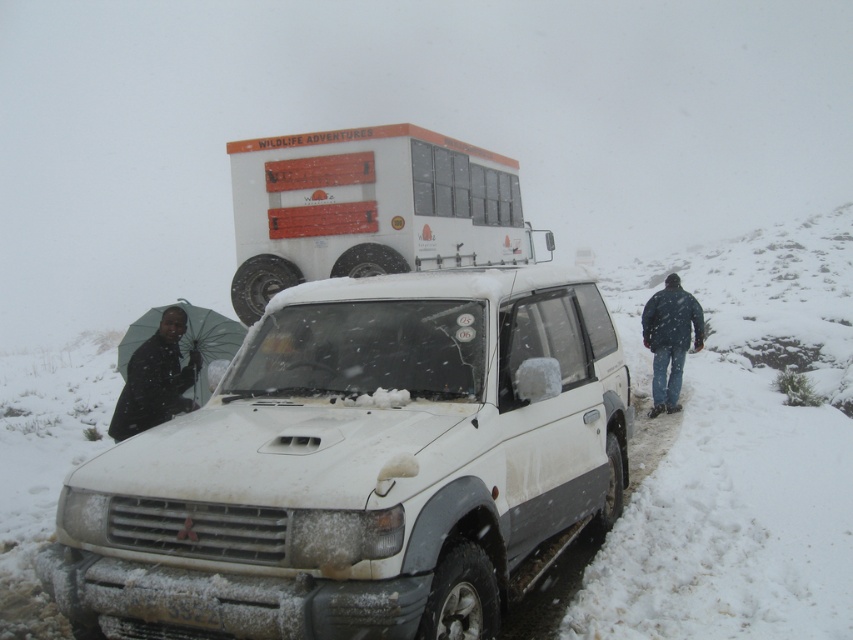
Can you confirm if white matte suv at center is smaller than white matte bus at upper center?

Actually, white matte suv at center might be larger than white matte bus at upper center.

Between point (250, 566) and point (386, 202), which one is positioned behind?

The point (386, 202) is more distant.

At what (x,y) coordinates should I click in order to perform the action: click on white matte suv at center. Please return your answer as a coordinate pair (x, y). This screenshot has width=853, height=640. Looking at the image, I should click on (360, 467).

Locate an element on the screen. black umbrella at left is located at coordinates pos(155,380).

Identify the location of black umbrella at left. (155, 380).

Is white matte suv at center closer to the viewer compared to black umbrella at left?

Yes, white matte suv at center is in front of black umbrella at left.

Which is above, white matte suv at center or black umbrella at left?

black umbrella at left

You are a GUI agent. You are given a task and a screenshot of the screen. Output one action in this format:
    pyautogui.click(x=<x>, y=<y>)
    Task: Click on the white matte suv at center
    The height and width of the screenshot is (640, 853).
    Given the screenshot: What is the action you would take?
    pyautogui.click(x=360, y=467)

I want to click on white matte suv at center, so click(360, 467).